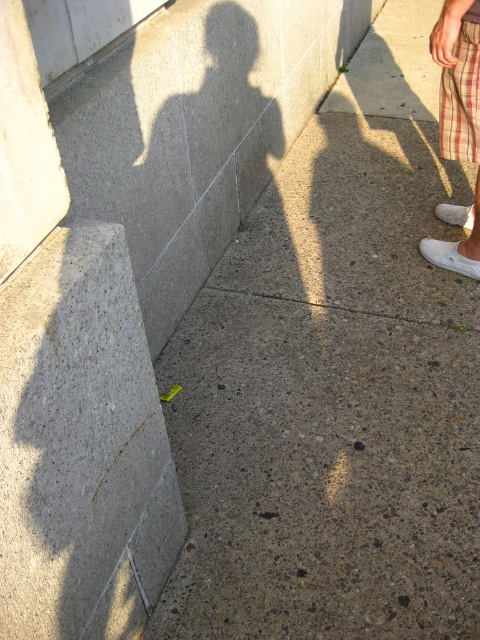
Between point (478, 276) and point (459, 212), which one is positioned behind?

The point (459, 212) is more distant.

Is white fabric shoe at lower right to the left of white matte shoe at right from the viewer's perspective?

Yes, white fabric shoe at lower right is to the left of white matte shoe at right.

Is point (435, 250) less distant than point (444, 214)?

Yes, it is.

Where is `white fabric shoe at lower right`? The image size is (480, 640). white fabric shoe at lower right is located at coordinates (448, 257).

Does gray concrete wall at left appear over white matte shoe at right?

No.

Is gray concrete wall at left bigger than white matte shoe at right?

Yes, gray concrete wall at left is bigger than white matte shoe at right.

Where is `gray concrete wall at left`? The width and height of the screenshot is (480, 640). gray concrete wall at left is located at coordinates (81, 445).

You are a GUI agent. You are given a task and a screenshot of the screen. Output one action in this format:
    pyautogui.click(x=<x>, y=<y>)
    Task: Click on the gray concrete wall at left
    
    Given the screenshot: What is the action you would take?
    pyautogui.click(x=81, y=445)

Which is more to the right, gray concrete wall at left or plaid fabric at right?

From the viewer's perspective, plaid fabric at right appears more on the right side.

Who is more distant from viewer, (113,595) or (468,54)?

Point (468,54)

Where is `gray concrete wall at left`? The width and height of the screenshot is (480, 640). gray concrete wall at left is located at coordinates (81, 445).